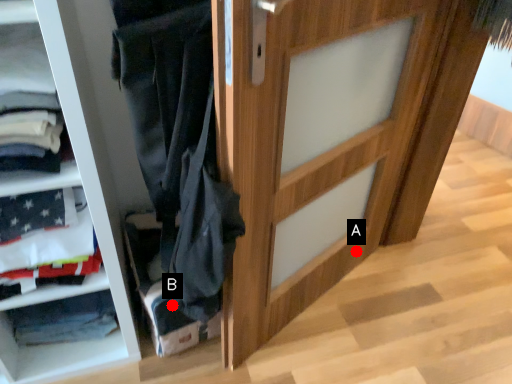
Question: Two points are circled on the image, labeled by A and B beside each circle. Which point is farther from the camera taking this photo?

Choices:
 (A) A is further
 (B) B is further

Answer: (A)